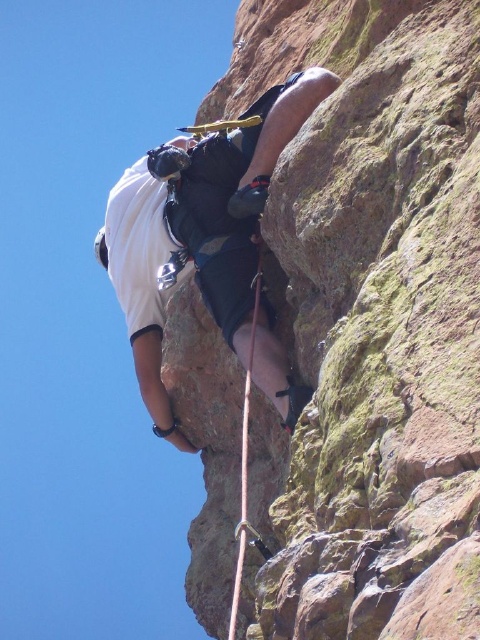
You are a safety inspector assessing the rock climbing setup. You notice the rusty rock at center and the white matte climbing harness at center. Based on their positions, which object is closer to the climber?

The rusty rock at center is in front of the white matte climbing harness at center, so the rusty rock at center is closer to the climber.